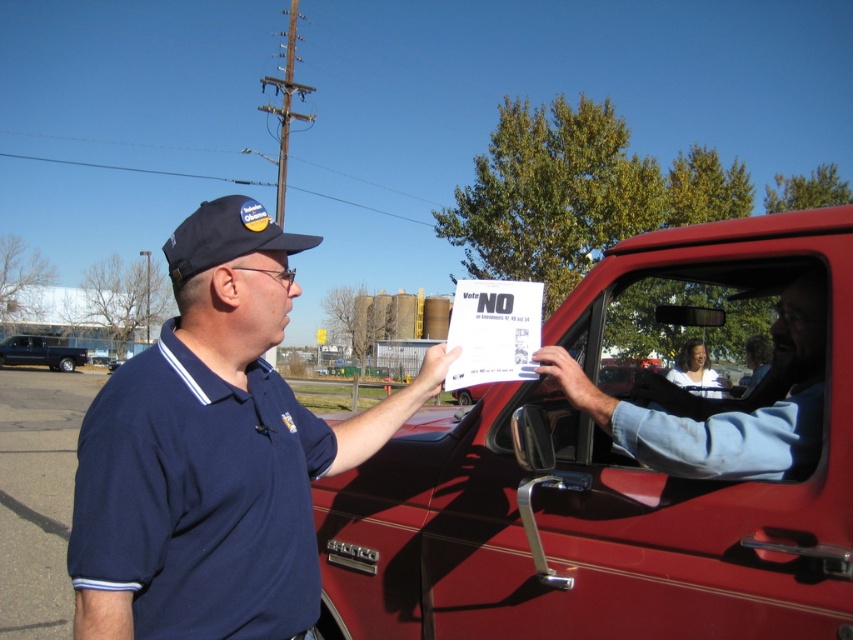
You are a pedestrian standing at the side of the road. You see the metallic red truck at center and the black matte van at left. Which vehicle is closer to you?

The metallic red truck at center is closer to you because it is in front of the black matte van at left.

Based on the scene, where is the metallic red truck at center located in the image?

The metallic red truck at center is located at point (611,476).

Based on the scene, which of the two points, point (792, 435) or point (15, 340), is closer to the man holding the Vote NO document?

Point (792, 435) is closer to the man holding the Vote NO document because it is in front of point (15, 340).